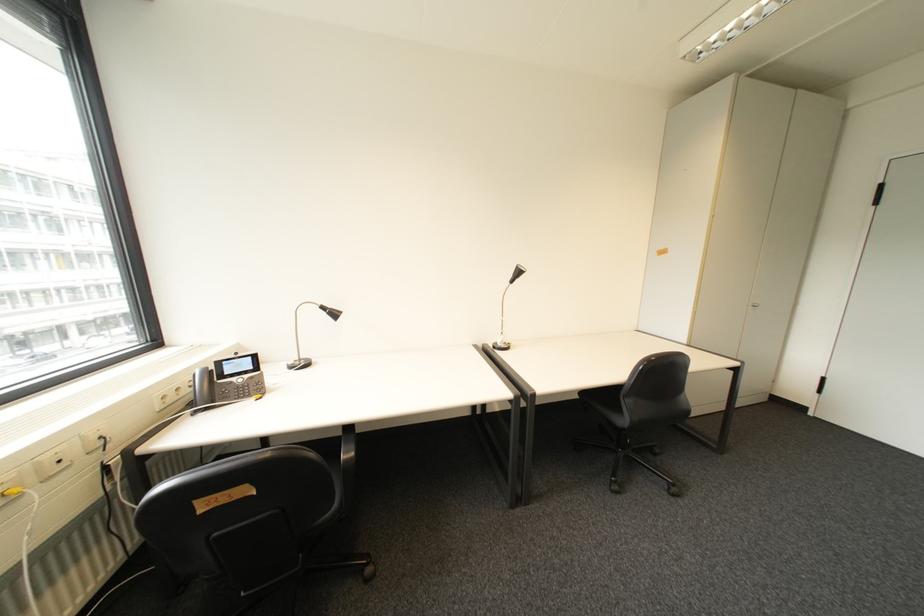
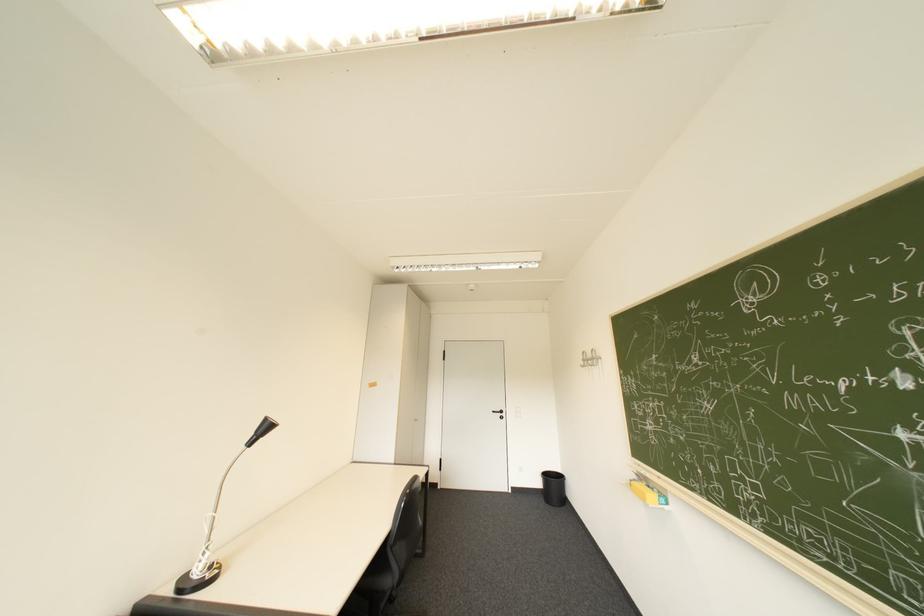
Where in the second image is the point corresponding to point (524, 275) from the first image?

(266, 434)